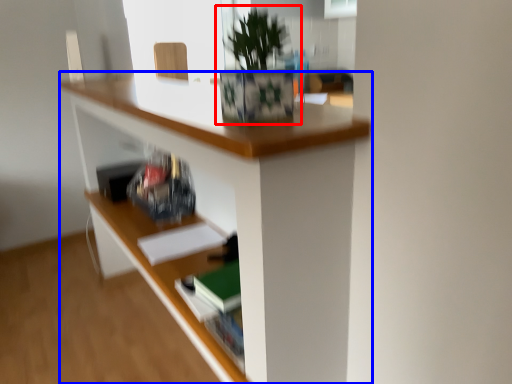
Question: Which object is closer to the camera taking this photo, houseplant (highlighted by a red box) or desk (highlighted by a blue box)?

Choices:
 (A) houseplant
 (B) desk

Answer: (B)